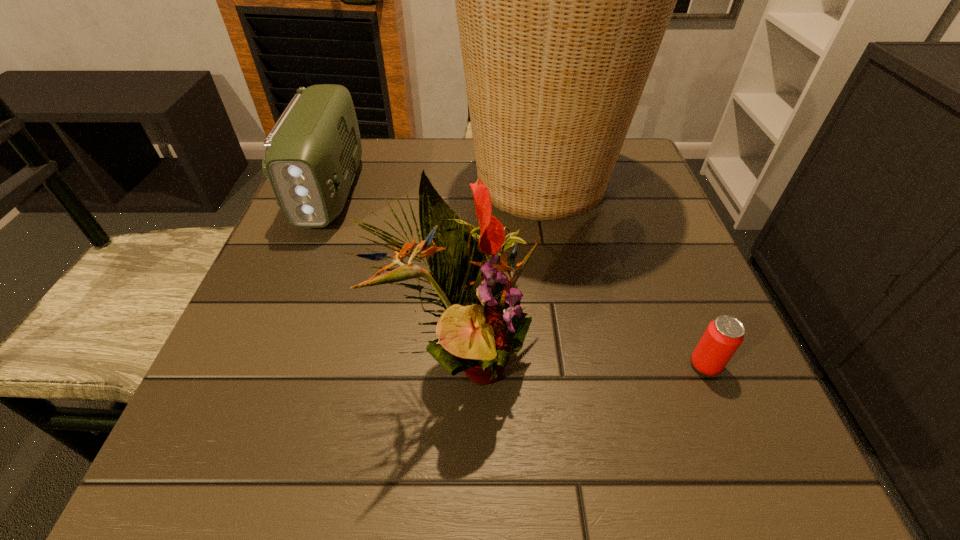
Where is `vacant space that satisfies the following two spatial constraints: 1. on the front side of the tallest object; 2. on the front-facing side of the third shortest object`? This screenshot has height=540, width=960. vacant space that satisfies the following two spatial constraints: 1. on the front side of the tallest object; 2. on the front-facing side of the third shortest object is located at coordinates (571, 357).

Locate an element on the screen. The height and width of the screenshot is (540, 960). free region that satisfies the following two spatial constraints: 1. on the back side of the beer can; 2. on the front-facing side of the second tallest object is located at coordinates (703, 357).

Locate an element on the screen. free region that satisfies the following two spatial constraints: 1. on the front-facing side of the second tallest object; 2. on the left side of the shortest object is located at coordinates (462, 364).

I want to click on free spot that satisfies the following two spatial constraints: 1. on the front-facing side of the bouquet; 2. on the left side of the beer can, so click(462, 364).

Identify the location of free space that satisfies the following two spatial constraints: 1. on the front-facing side of the shortest object; 2. on the left side of the radio_receiver. (259, 364).